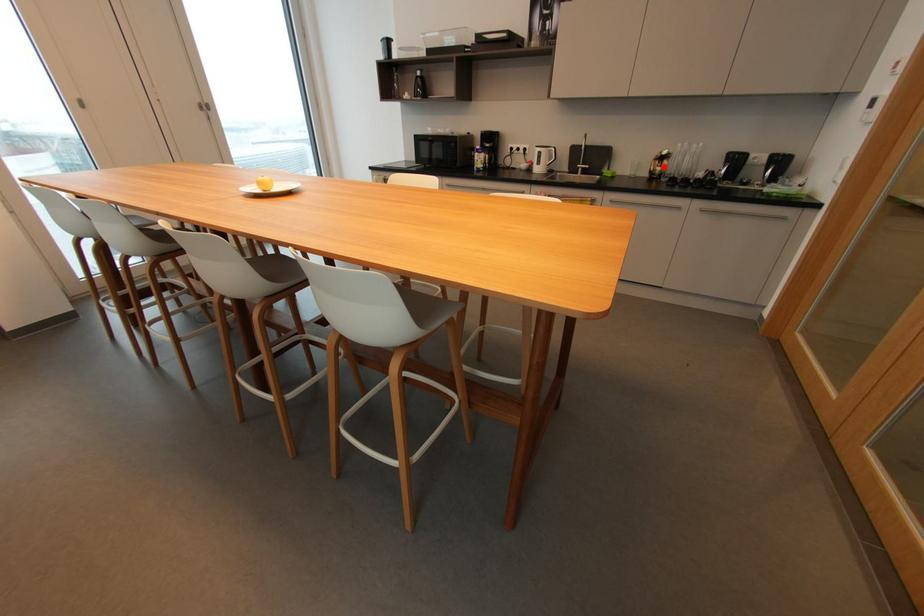
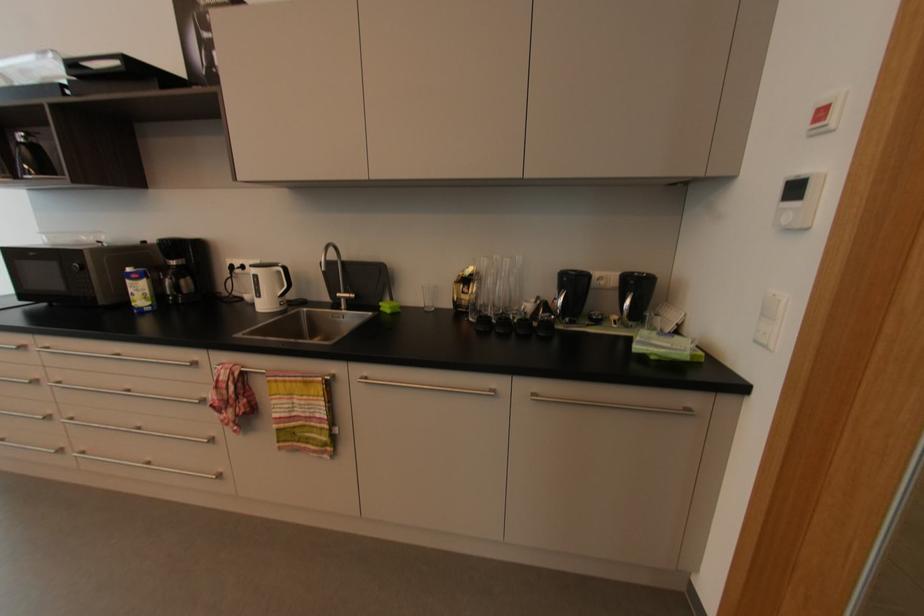
Where in the second image is the point corresponding to the highlighted location from the first image?

(469, 294)